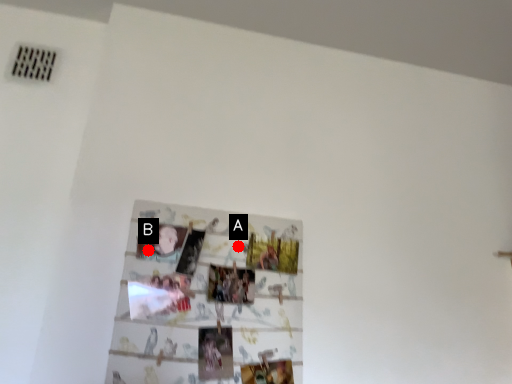
Question: Two points are circled on the image, labeled by A and B beside each circle. Which of the following is the closest to the observer?

Choices:
 (A) A is closer
 (B) B is closer

Answer: (B)